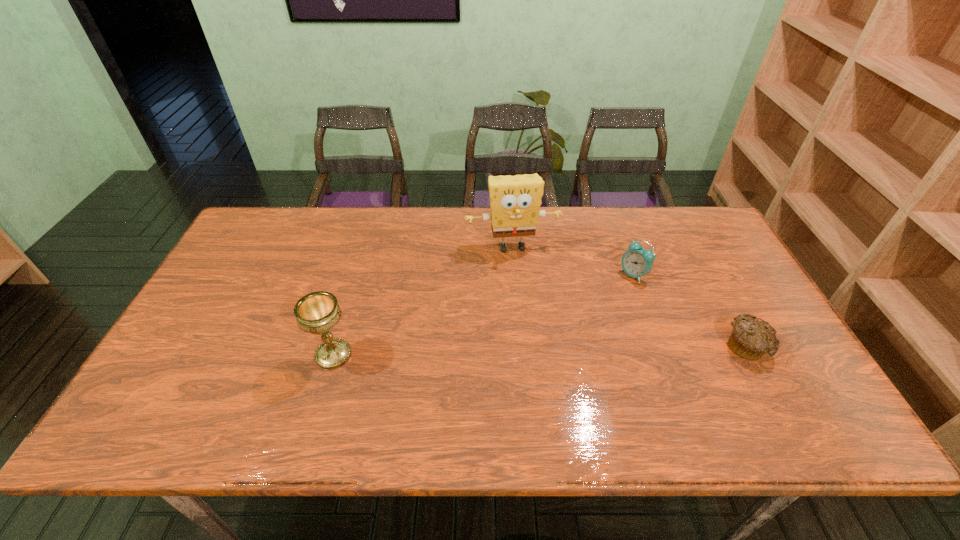
Find the location of a particular element. This screenshot has height=540, width=960. vacant area that lies between the muffin and the third nearest object is located at coordinates (690, 311).

Where is `free space that is in between the third object from left to right and the rightmost object`? The height and width of the screenshot is (540, 960). free space that is in between the third object from left to right and the rightmost object is located at coordinates (690, 311).

Image resolution: width=960 pixels, height=540 pixels. In order to click on unoccupied area between the leftmost object and the second shortest object in this screenshot , I will do `click(484, 315)`.

You are a GUI agent. You are given a task and a screenshot of the screen. Output one action in this format:
    pyautogui.click(x=<x>, y=<y>)
    Task: Click on the free space that is in between the muffin and the third tallest object
    The height and width of the screenshot is (540, 960).
    Given the screenshot: What is the action you would take?
    pyautogui.click(x=690, y=311)

This screenshot has width=960, height=540. In order to click on blank region between the shortest object and the tallest object in this screenshot , I will do `click(630, 297)`.

Point out which object is positioned as the third nearest to the muffin. Please provide its 2D coordinates. Your answer should be formatted as a tuple, i.e. [(x, y)], where the tuple contains the x and y coordinates of a point satisfying the conditions above.

[(318, 312)]

Point out which object is positioned as the third nearest to the third shortest object. Please provide its 2D coordinates. Your answer should be formatted as a tuple, i.e. [(x, y)], where the tuple contains the x and y coordinates of a point satisfying the conditions above.

[(750, 339)]

Locate an element on the screen. free spot that satisfies the following two spatial constraints: 1. on the front side of the third nearest object; 2. on the right side of the shortest object is located at coordinates (660, 347).

At what (x,y) coordinates should I click in order to perform the action: click on free point that satisfies the following two spatial constraints: 1. on the front side of the alarm clock; 2. on the left side of the rightmost object. Please return your answer as a coordinate pair (x, y). This screenshot has height=540, width=960. Looking at the image, I should click on (660, 347).

The image size is (960, 540). Find the location of `vacant area that satisfies the following two spatial constraints: 1. on the back side of the third shortest object; 2. on the left side of the farthest object`. vacant area that satisfies the following two spatial constraints: 1. on the back side of the third shortest object; 2. on the left side of the farthest object is located at coordinates (365, 247).